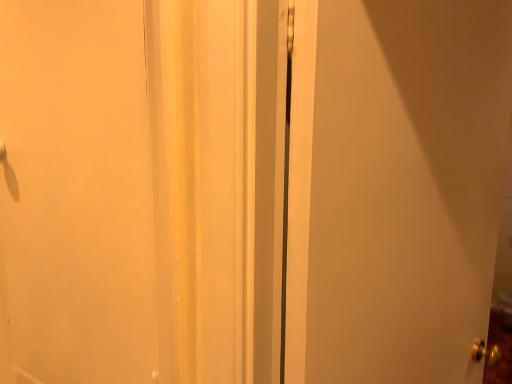
This screenshot has height=384, width=512. I want to click on white matte screen door at right, so click(395, 187).

Measure the distance between white matte screen door at right and camera.

The distance of white matte screen door at right from camera is 20.38 inches.

What do you see at coordinates (395, 187) in the screenshot? I see `white matte screen door at right` at bounding box center [395, 187].

Where is `white matte screen door at right`? white matte screen door at right is located at coordinates (395, 187).